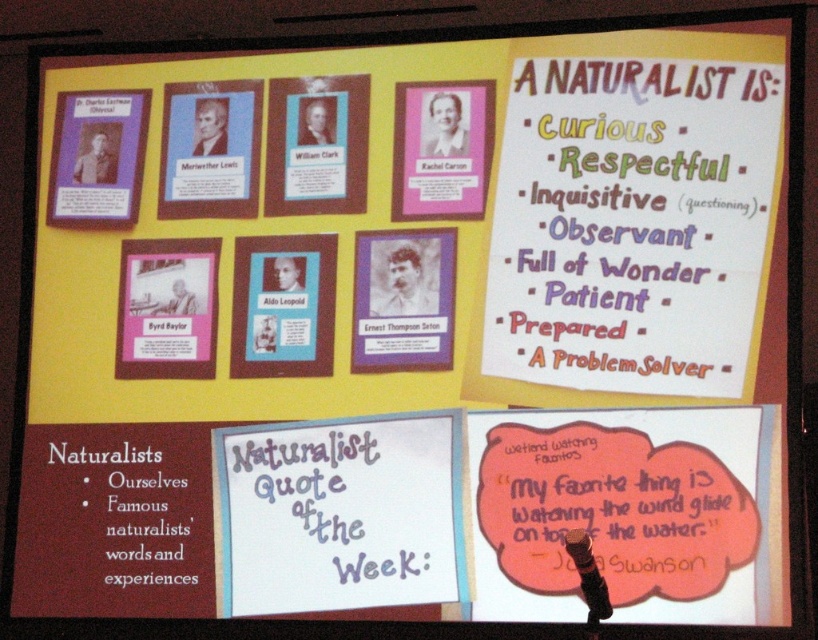
Question: Estimate the real-world distances between objects in this image. Which object is closer to the purple paper at center?

Choices:
 (A) orange paper quote at lower right
 (B) pink paper rachel carson portrait at upper center

Answer: (A)

Question: Where is white paper at upper right located in relation to beige paper ernest thompson seton portrait at center in the image?

Choices:
 (A) left
 (B) right

Answer: (B)

Question: Which object is closer to the camera taking this photo?

Choices:
 (A) beige paper ernest thompson seton portrait at center
 (B) matte purple card at upper left

Answer: (A)

Question: Based on their relative distances, which object is nearer to the beige paper ernest thompson seton portrait at center?

Choices:
 (A) pink paper rachel carson portrait at upper center
 (B) matte purple card at upper left
 (C) white paper at upper right

Answer: (A)

Question: Does orange paper quote at lower right lie behind purple paper at center?

Choices:
 (A) no
 (B) yes

Answer: (A)

Question: Is pink paper rachel carson portrait at upper center positioned in front of matte purple card at upper left?

Choices:
 (A) no
 (B) yes

Answer: (B)